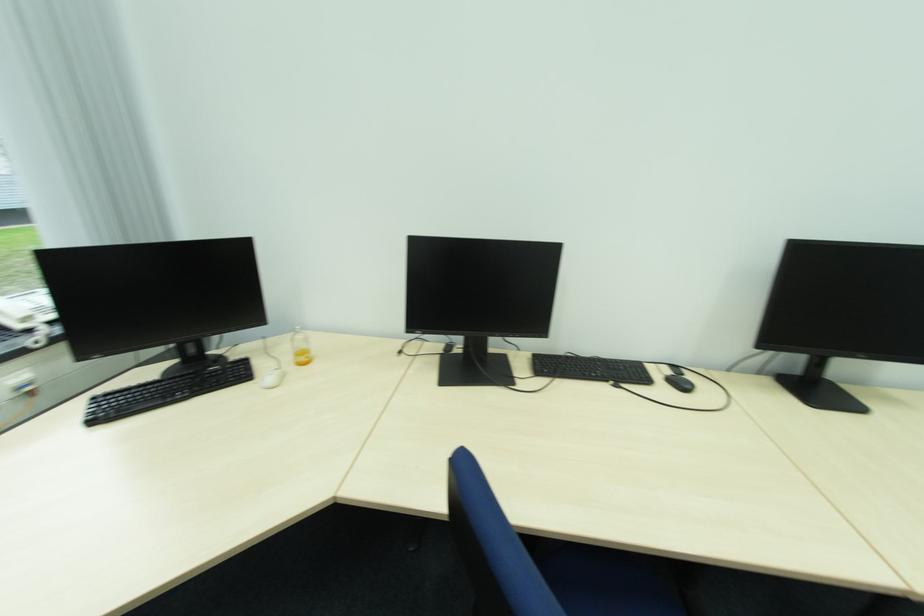
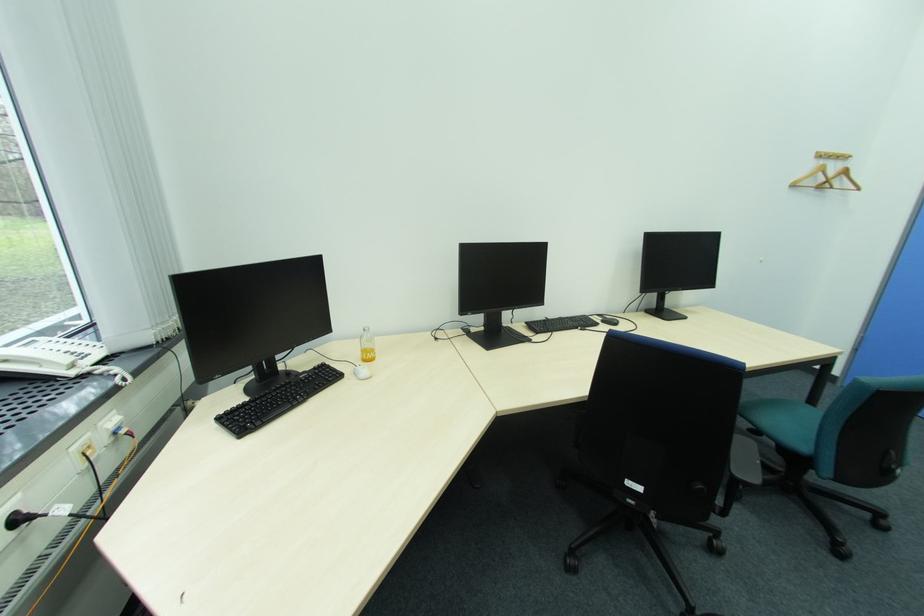
Question: What movement of the cameraman would produce the second image?

Choices:
 (A) Left
 (B) Right
 (C) Forward
 (D) Backward

Answer: (A)